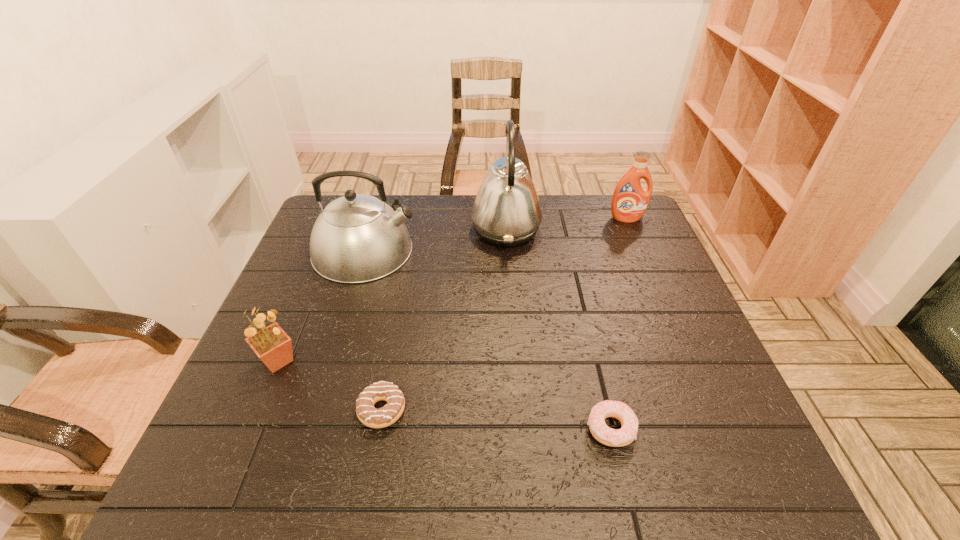
Identify the location of sunflower at the left edge. The width and height of the screenshot is (960, 540). (273, 346).

Find the location of a particular element. The height and width of the screenshot is (540, 960). object that is at the right edge is located at coordinates (629, 202).

Image resolution: width=960 pixels, height=540 pixels. In order to click on object present at the far left corner in this screenshot , I will do `click(357, 238)`.

Image resolution: width=960 pixels, height=540 pixels. In order to click on object that is at the far right corner in this screenshot , I will do `click(629, 202)`.

Where is `free region at the far edge of the desktop`? The width and height of the screenshot is (960, 540). free region at the far edge of the desktop is located at coordinates tap(545, 221).

Locate an element on the screen. vacant region at the near edge of the desktop is located at coordinates (533, 463).

You are a GUI agent. You are given a task and a screenshot of the screen. Output one action in this format:
    pyautogui.click(x=<x>, y=<y>)
    Task: Click on the free space at the left edge
    The height and width of the screenshot is (540, 960).
    Given the screenshot: What is the action you would take?
    pyautogui.click(x=285, y=369)

In the image, there is a desktop. At what (x,y) coordinates should I click in order to perform the action: click on vacant area at the right edge. Please return your answer as a coordinate pair (x, y). Image resolution: width=960 pixels, height=540 pixels. Looking at the image, I should click on (658, 291).

In the image, there is a desktop. Where is `vacant space at the far right corner`? vacant space at the far right corner is located at coordinates (597, 227).

Identify the location of empty space between the fifth object from left to right and the fourth shortest object. The height and width of the screenshot is (540, 960). (618, 323).